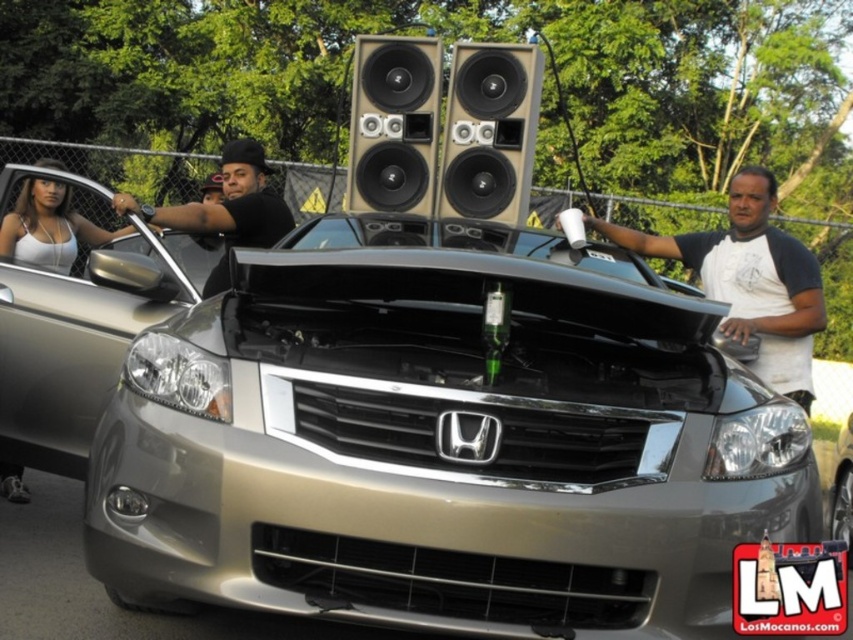
Question: Can you confirm if black matte shirt at center is thinner than metallic silver car at center?

Choices:
 (A) no
 (B) yes

Answer: (B)

Question: Among these objects, which one is nearest to the camera?

Choices:
 (A) satin silver car at center
 (B) matte black speaker at center
 (C) beige matte speaker at center

Answer: (A)

Question: Which object is farther from the camera taking this photo?

Choices:
 (A) white cotton t-shirt at center
 (B) beige matte speaker at center
 (C) black matte shirt at center

Answer: (B)

Question: Can you confirm if white cotton t-shirt at center is thinner than matte white tank top at left?

Choices:
 (A) no
 (B) yes

Answer: (A)

Question: Is white cotton t-shirt at center above metallic silver car at center?

Choices:
 (A) yes
 (B) no

Answer: (A)

Question: Estimate the real-world distances between objects in this image. Which object is closer to the matte black speaker at center?

Choices:
 (A) beige matte speaker at center
 (B) matte white tank top at left
 (C) satin silver car at center

Answer: (A)